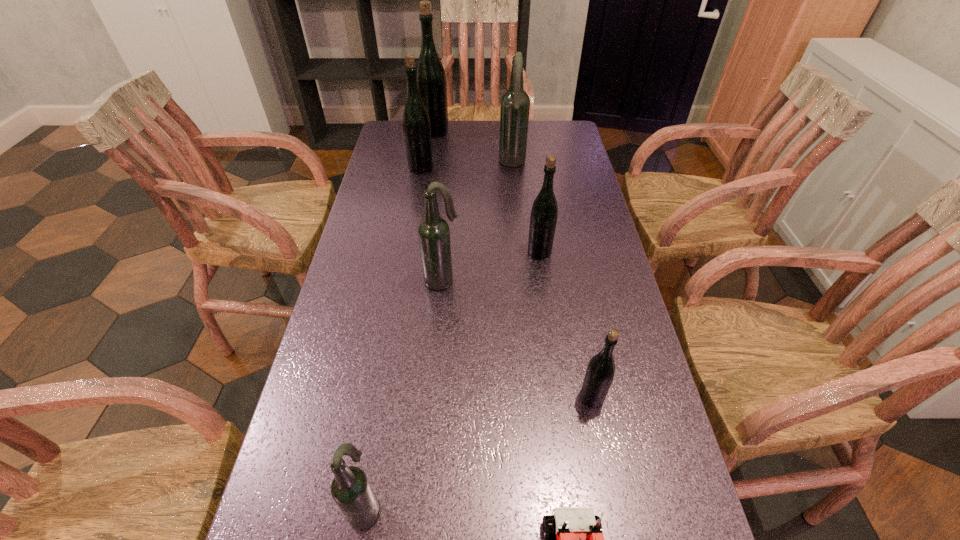
Locate an element on the screen. The height and width of the screenshot is (540, 960). free space between the farthest dark beer bottle and the fifth nearest object is located at coordinates (526, 208).

Locate an element on the screen. The image size is (960, 540). object that stands as the third closest to the farthest beer bottle is located at coordinates (544, 212).

The image size is (960, 540). Find the location of `object that is the third closest to the second biggest dark beer bottle`. object that is the third closest to the second biggest dark beer bottle is located at coordinates (416, 124).

You are a GUI agent. You are given a task and a screenshot of the screen. Output one action in this format:
    pyautogui.click(x=<x>, y=<y>)
    Task: Click on the beer bottle that is the sixth closest to the fifth farthest object
    
    Given the screenshot: What is the action you would take?
    click(x=431, y=78)

Identify the location of the third closest beer bottle relative to the sixth farthest beer bottle. The height and width of the screenshot is (540, 960). (350, 488).

The height and width of the screenshot is (540, 960). Find the location of `green beer bottle object that ranks as the fourth closest to the smallest dark beer bottle`. green beer bottle object that ranks as the fourth closest to the smallest dark beer bottle is located at coordinates (431, 78).

The width and height of the screenshot is (960, 540). I want to click on the closest green beer bottle to the second biggest dark beer bottle, so click(x=544, y=212).

Identify which dark beer bottle is the second nearest to the rightmost dark beer bottle. Please provide its 2D coordinates. Your answer should be formatted as a tuple, i.e. [(x, y)], where the tuple contains the x and y coordinates of a point satisfying the conditions above.

[(350, 488)]

Locate an element on the screen. The height and width of the screenshot is (540, 960). the second closest dark beer bottle to the fourth farthest beer bottle is located at coordinates 515,104.

The image size is (960, 540). In order to click on free space that satisfies the following two spatial constraints: 1. on the back side of the nearest dark beer bottle; 2. on the right side of the farthest dark beer bottle in this screenshot , I will do `click(422, 164)`.